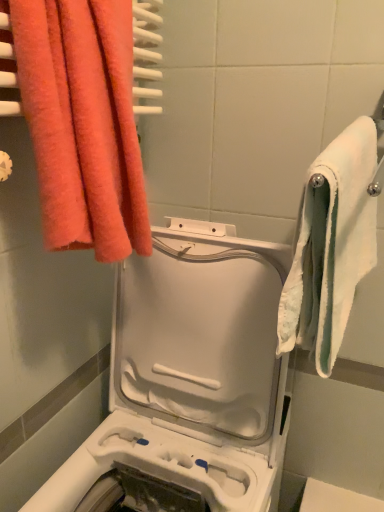
Find the location of `fluffy coral towel at upper left, which is the 1th towel in left-to-right order`. fluffy coral towel at upper left, which is the 1th towel in left-to-right order is located at coordinates (83, 122).

The width and height of the screenshot is (384, 512). Describe the element at coordinates (83, 122) in the screenshot. I see `fluffy coral towel at upper left, the 2th towel in the right-to-left sequence` at that location.

Identify the location of white plastic washing machine at center. (187, 381).

Is white plastic washing machine at center situated inside white soft towel at right, placed as the second towel when sorted from left to right, or outside?

white plastic washing machine at center cannot be found inside white soft towel at right, placed as the second towel when sorted from left to right.

From a real-world perspective, which is physically above, white plastic washing machine at center or white soft towel at right, placed as the second towel when sorted from left to right?

white soft towel at right, placed as the second towel when sorted from left to right.

Is white soft towel at right, placed as the second towel when sorted from left to right, at the back of white plastic washing machine at center?

white plastic washing machine at center is not turned away from white soft towel at right, placed as the second towel when sorted from left to right.

Is there a large distance between white plastic washing machine at center and white soft towel at right, the first towel in the right-to-left sequence?

white plastic washing machine at center is actually quite close to white soft towel at right, the first towel in the right-to-left sequence.

Considering the sizes of objects white fabric towel at right and white plastic washing machine at center in the image provided, who is bigger, white fabric towel at right or white plastic washing machine at center?

white plastic washing machine at center.

The height and width of the screenshot is (512, 384). Identify the location of washing machine on the left side of white fabric towel at right. (187, 381).

Would you say white fabric towel at right is outside white plastic washing machine at center?

white fabric towel at right is positioned outside white plastic washing machine at center.

Is white fabric towel at right in front of or behind white plastic washing machine at center in the image?

Visually, white fabric towel at right is located behind white plastic washing machine at center.

Considering the relative sizes of white soft towel at right, the first towel in the right-to-left sequence, and fluffy coral towel at upper left, the 2th towel in the right-to-left sequence, in the image provided, is white soft towel at right, the first towel in the right-to-left sequence, thinner than fluffy coral towel at upper left, the 2th towel in the right-to-left sequence,?

No.

Which is more to the right, white soft towel at right, placed as the second towel when sorted from left to right, or fluffy coral towel at upper left, the 2th towel in the right-to-left sequence?

white soft towel at right, placed as the second towel when sorted from left to right.

Is white soft towel at right, placed as the second towel when sorted from left to right, facing towards fluffy coral towel at upper left, the 2th towel in the right-to-left sequence?

No, white soft towel at right, placed as the second towel when sorted from left to right, is not facing towards fluffy coral towel at upper left, the 2th towel in the right-to-left sequence.

Looking at this image, is white soft towel at right, the first towel in the right-to-left sequence, bigger than fluffy coral towel at upper left, the 2th towel in the right-to-left sequence?

Yes, white soft towel at right, the first towel in the right-to-left sequence, is bigger than fluffy coral towel at upper left, the 2th towel in the right-to-left sequence.

You are a GUI agent. You are given a task and a screenshot of the screen. Output one action in this format:
    pyautogui.click(x=<x>, y=<y>)
    Task: Click on the washing machine on the left of white soft towel at right, the first towel in the right-to-left sequence
    
    Given the screenshot: What is the action you would take?
    pyautogui.click(x=187, y=381)

Who is smaller, white soft towel at right, the first towel in the right-to-left sequence, or white plastic washing machine at center?

Smaller between the two is white soft towel at right, the first towel in the right-to-left sequence.

From a real-world perspective, which object stands above the other?

From a 3D spatial view, white soft towel at right, the first towel in the right-to-left sequence, is above.

Is white plastic washing machine at center in front of fluffy coral towel at upper left, which is the 1th towel in left-to-right order?

That is True.

From the image's perspective, is white plastic washing machine at center below fluffy coral towel at upper left, the 2th towel in the right-to-left sequence?

Yes, from the image's perspective, white plastic washing machine at center is below fluffy coral towel at upper left, the 2th towel in the right-to-left sequence.

Looking at this image, is white plastic washing machine at center positioned far away from fluffy coral towel at upper left, which is the 1th towel in left-to-right order?

No, white plastic washing machine at center is in close proximity to fluffy coral towel at upper left, which is the 1th towel in left-to-right order.

Could you tell me if white plastic washing machine at center is turned towards fluffy coral towel at upper left, the 2th towel in the right-to-left sequence?

No.

Which towel is the 1st one when counting from the left side of the white fabric towel at right? Please provide its 2D coordinates.

[(331, 246)]

From the image's perspective, does white soft towel at right, the first towel in the right-to-left sequence, appear lower than white fabric towel at right?

Yes, from the image's perspective, white soft towel at right, the first towel in the right-to-left sequence, is below white fabric towel at right.

Is white fabric towel at right a part of white soft towel at right, placed as the second towel when sorted from left to right?

Yes, white fabric towel at right is a part of white soft towel at right, placed as the second towel when sorted from left to right.

Is white plastic washing machine at center positioned with its back to white fabric towel at right?

No, white fabric towel at right is not at the back of white plastic washing machine at center.

Find the location of a particular element. washing machine below the white fabric towel at right (from the image's perspective) is located at coordinates (187, 381).

Based on the photo, is white plastic washing machine at center positioned beyond the bounds of white fabric towel at right?

white plastic washing machine at center is positioned outside white fabric towel at right.

How different are the orientations of white plastic washing machine at center and white fabric towel at right in degrees?

The angular difference between white plastic washing machine at center and white fabric towel at right is 92.8 degrees.

The width and height of the screenshot is (384, 512). I want to click on washing machine below the white soft towel at right, placed as the second towel when sorted from left to right (from a real-world perspective), so click(x=187, y=381).

You are a GUI agent. You are given a task and a screenshot of the screen. Output one action in this format:
    pyautogui.click(x=<x>, y=<y>)
    Task: Click on the washing machine in front of the white fabric towel at right
    
    Given the screenshot: What is the action you would take?
    pyautogui.click(x=187, y=381)

Based on their spatial positions, is fluffy coral towel at upper left, the 2th towel in the right-to-left sequence, or white plastic washing machine at center further from white fabric towel at right?

white plastic washing machine at center is positioned further to the anchor white fabric towel at right.

From the image, which object appears to be nearer to white soft towel at right, placed as the second towel when sorted from left to right, white fabric towel at right or fluffy coral towel at upper left, the 2th towel in the right-to-left sequence?

Among the two, fluffy coral towel at upper left, the 2th towel in the right-to-left sequence, is located nearer to white soft towel at right, placed as the second towel when sorted from left to right.

From the image, which object appears to be farther from fluffy coral towel at upper left, the 2th towel in the right-to-left sequence, white fabric towel at right or white soft towel at right, placed as the second towel when sorted from left to right?

white fabric towel at right lies further to fluffy coral towel at upper left, the 2th towel in the right-to-left sequence, than the other object.

When comparing their distances from white soft towel at right, placed as the second towel when sorted from left to right, does fluffy coral towel at upper left, the 2th towel in the right-to-left sequence, or white plastic washing machine at center seem closer?

white plastic washing machine at center.

Which object lies nearer to the anchor point fluffy coral towel at upper left, the 2th towel in the right-to-left sequence, white plastic washing machine at center or white fabric towel at right?

Based on the image, white plastic washing machine at center appears to be nearer to fluffy coral towel at upper left, the 2th towel in the right-to-left sequence.

Based on their spatial positions, is white plastic washing machine at center or white soft towel at right, placed as the second towel when sorted from left to right, further from white fabric towel at right?

The object further to white fabric towel at right is white plastic washing machine at center.

When comparing their distances from fluffy coral towel at upper left, which is the 1th towel in left-to-right order, does white soft towel at right, the first towel in the right-to-left sequence, or white fabric towel at right seem further?

The object further to fluffy coral towel at upper left, which is the 1th towel in left-to-right order, is white fabric towel at right.

Considering their positions, is white plastic washing machine at center positioned closer to fluffy coral towel at upper left, which is the 1th towel in left-to-right order, than white soft towel at right, the first towel in the right-to-left sequence?

Among the two, white soft towel at right, the first towel in the right-to-left sequence, is located nearer to fluffy coral towel at upper left, which is the 1th towel in left-to-right order.

The image size is (384, 512). I want to click on towel between fluffy coral towel at upper left, which is the 1th towel in left-to-right order, and white fabric towel at right from left to right, so click(331, 246).

The height and width of the screenshot is (512, 384). I want to click on towel between fluffy coral towel at upper left, the 2th towel in the right-to-left sequence, and white plastic washing machine at center in the up-down direction, so click(331, 246).